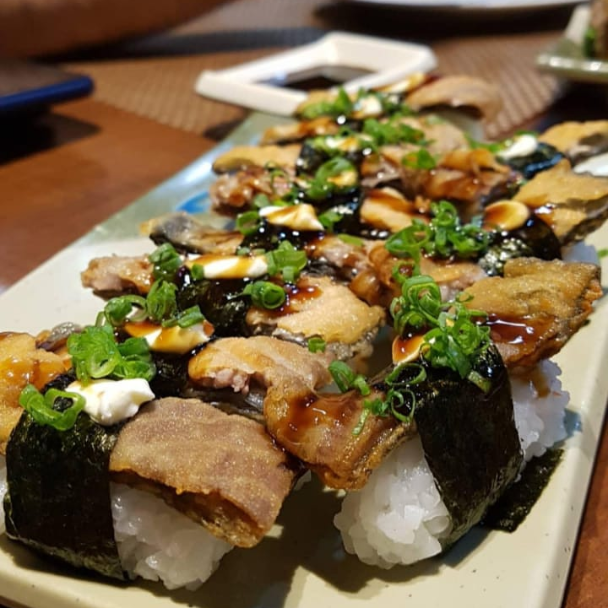
Locate an element on the screen. plates is located at coordinates (474, 565), (270, 86).